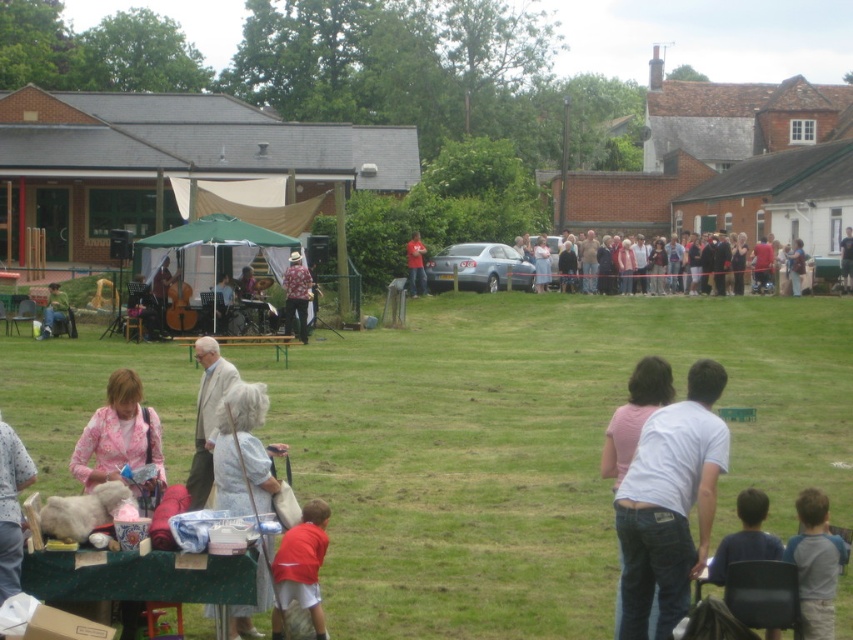
Question: Which point is farther from the camera taking this photo?

Choices:
 (A) (86, 426)
 (B) (802, 282)

Answer: (B)

Question: Does dark blue shirt at lower right appear over floral fabric hat at center?

Choices:
 (A) yes
 (B) no

Answer: (B)

Question: Which of the following is the farthest from the observer?

Choices:
 (A) (809, 600)
 (B) (422, 292)
 (C) (106, 400)

Answer: (B)

Question: Which of the following is the farthest from the observer?

Choices:
 (A) dark blue shirt at lower right
 (B) dark blue t-shirt at center

Answer: (B)

Question: Is white cotton shirt at center bigger than floral fabric hat at center?

Choices:
 (A) no
 (B) yes

Answer: (A)

Question: In this image, where is white fabric bag at lower center located relative to pink fabric shirt at center?

Choices:
 (A) left
 (B) right

Answer: (A)